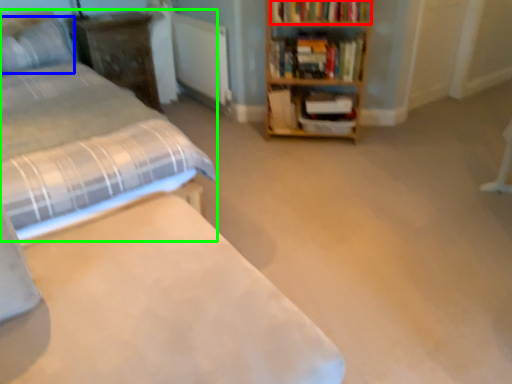
Question: Which object is the closest to the book (highlighted by a red box)? Choose among these: pillow (highlighted by a blue box) or bed (highlighted by a green box).

Choices:
 (A) pillow
 (B) bed

Answer: (B)